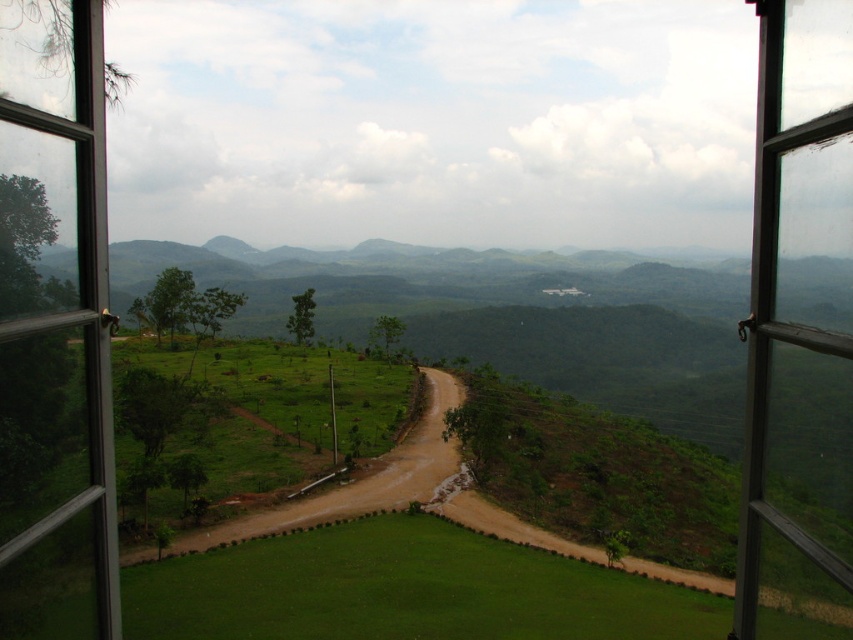
Is clear glass window at left positioned behind brown dirt track at lower left?

No.

Does clear glass window at left have a greater height compared to brown dirt track at lower left?

In fact, clear glass window at left may be shorter than brown dirt track at lower left.

This screenshot has height=640, width=853. What do you see at coordinates (54, 328) in the screenshot?
I see `clear glass window at left` at bounding box center [54, 328].

Where is `clear glass window at left`? This screenshot has height=640, width=853. clear glass window at left is located at coordinates (54, 328).

Can you confirm if clear glass window at right is taller than brown dirt track at lower left?

No, clear glass window at right is not taller than brown dirt track at lower left.

Is clear glass window at right wider than brown dirt track at lower left?

No, clear glass window at right is not wider than brown dirt track at lower left.

Is point (811, 300) less distant than point (125, 563)?

Yes, it is.

Where is `clear glass window at right`? The image size is (853, 640). clear glass window at right is located at coordinates [799, 332].

Is clear glass window at left positioned at the back of clear glass window at right?

Yes, it is behind clear glass window at right.

Does clear glass window at left have a greater width compared to clear glass window at right?

In fact, clear glass window at left might be narrower than clear glass window at right.

Locate an element on the screen. The height and width of the screenshot is (640, 853). clear glass window at left is located at coordinates (54, 328).

Locate an element on the screen. Image resolution: width=853 pixels, height=640 pixels. clear glass window at left is located at coordinates (54, 328).